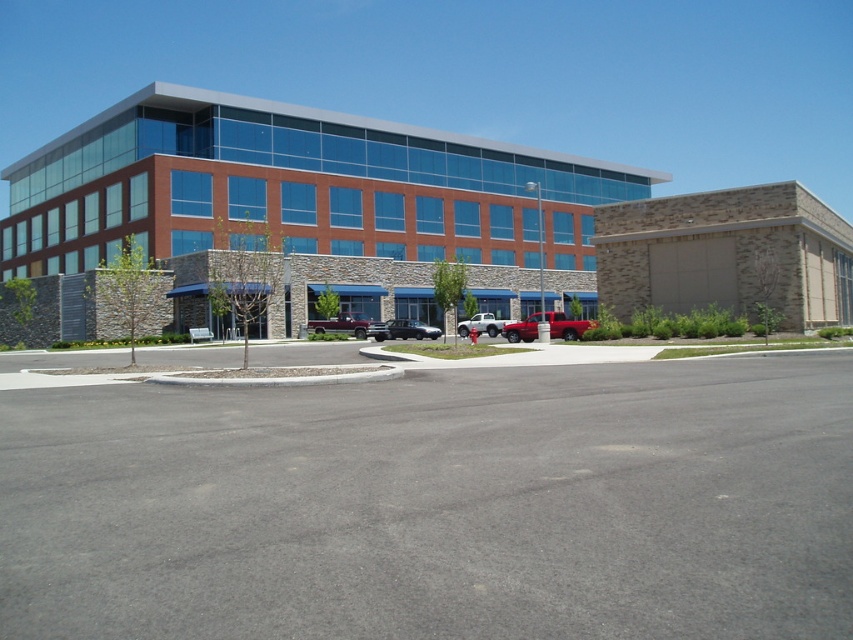
Between matte red truck at center and shiny black sedan at center, which one has more height?

matte red truck at center is taller.

Based on the photo, who is shorter, matte red truck at center or shiny black sedan at center?

With less height is shiny black sedan at center.

What do you see at coordinates (349, 324) in the screenshot? This screenshot has width=853, height=640. I see `matte red truck at center` at bounding box center [349, 324].

The image size is (853, 640). What are the coordinates of `matte red truck at center` in the screenshot? It's located at (349, 324).

Is the position of metallic red truck at center more distant than that of matte red truck at center?

No, metallic red truck at center is in front of matte red truck at center.

Locate an element on the screen. metallic red truck at center is located at coordinates tap(566, 324).

Is gray asphalt parking lot at center taller than shiny black sedan at center?

In fact, gray asphalt parking lot at center may be shorter than shiny black sedan at center.

Locate an element on the screen. This screenshot has width=853, height=640. gray asphalt parking lot at center is located at coordinates (436, 504).